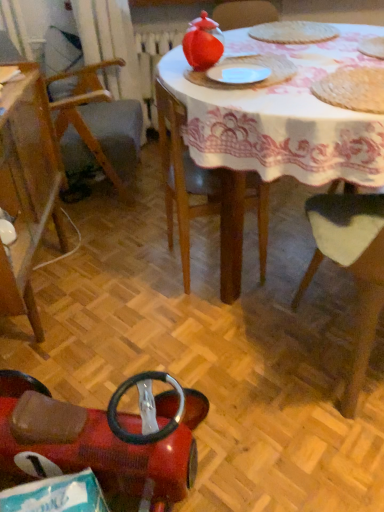
I want to click on vacant space situated on the left part of wooden chair at lower right, the 3th chair in the left-to-right sequence, so click(x=245, y=357).